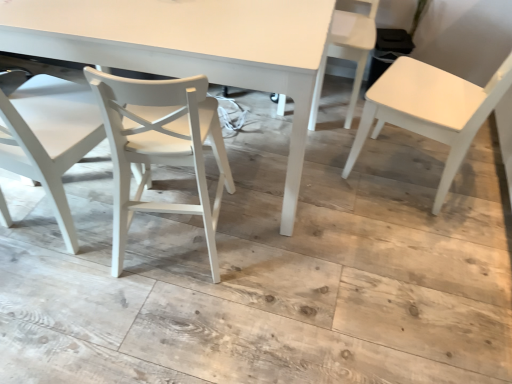
Question: Visually, is white plastic chair at upper right, the third chair positioned from the left, positioned to the left or to the right of white matte chair at left, marked as the first chair in a left-to-right arrangement?

Choices:
 (A) left
 (B) right

Answer: (B)

Question: Is white plastic chair at upper right, the 2th chair from the right, taller or shorter than white matte chair at left, which is counted as the fourth chair, starting from the right?

Choices:
 (A) short
 (B) tall

Answer: (A)

Question: Which is nearer to the white plastic chair at upper right, the 2th chair from the right?

Choices:
 (A) white matte chair at center, marked as the second chair in a left-to-right arrangement
 (B) white matte chair at right, arranged as the 1th chair when viewed from the right
 (C) white matte chair at left, marked as the first chair in a left-to-right arrangement
 (D) white matte table at center

Answer: (B)

Question: Which object is positioned closest to the white matte chair at right, placed as the fourth chair when sorted from left to right?

Choices:
 (A) white plastic chair at upper right, the 2th chair from the right
 (B) white matte table at center
 (C) white matte chair at center, marked as the second chair in a left-to-right arrangement
 (D) white matte chair at left, which is counted as the fourth chair, starting from the right

Answer: (A)